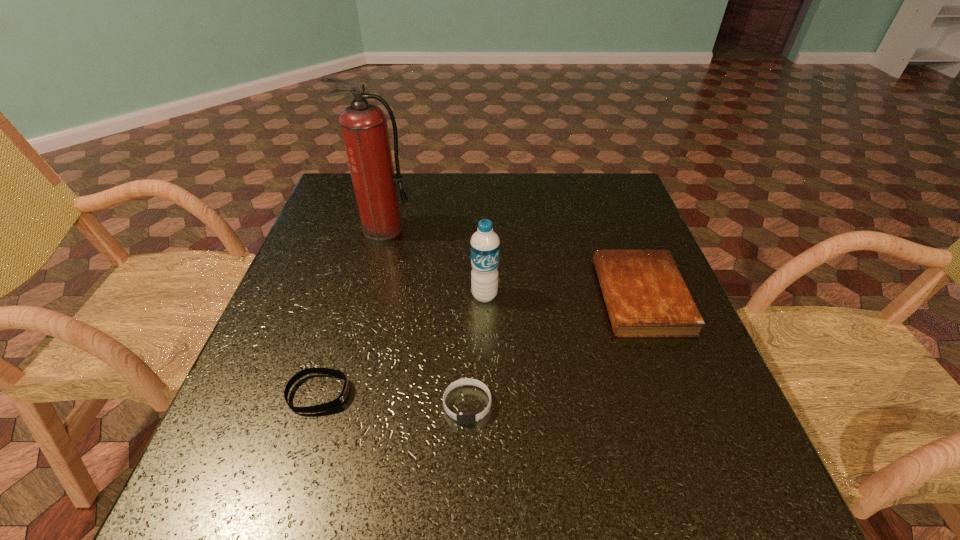
The image size is (960, 540). In order to click on the farthest object in this screenshot , I will do `click(364, 128)`.

The image size is (960, 540). Identify the location of the tallest object. (364, 128).

You are a GUI agent. You are given a task and a screenshot of the screen. Output one action in this format:
    pyautogui.click(x=<x>, y=<y>)
    Task: Click on the fourth shortest object
    The width and height of the screenshot is (960, 540).
    Given the screenshot: What is the action you would take?
    pyautogui.click(x=484, y=245)

The image size is (960, 540). I want to click on the third tallest object, so click(645, 295).

Where is `Bible`? The image size is (960, 540). Bible is located at coordinates (645, 295).

This screenshot has width=960, height=540. Identify the location of the right wristband. (463, 418).

The height and width of the screenshot is (540, 960). What are the coordinates of `the taller wristband` in the screenshot? It's located at (463, 418).

Where is `the shorter wristband`? The image size is (960, 540). the shorter wristband is located at coordinates (336, 403).

This screenshot has height=540, width=960. Find the location of `the left wristband`. the left wristband is located at coordinates click(336, 403).

This screenshot has height=540, width=960. What are the coordinates of `free space located 0.240m at the nozzle of the farthest object` in the screenshot? It's located at (363, 309).